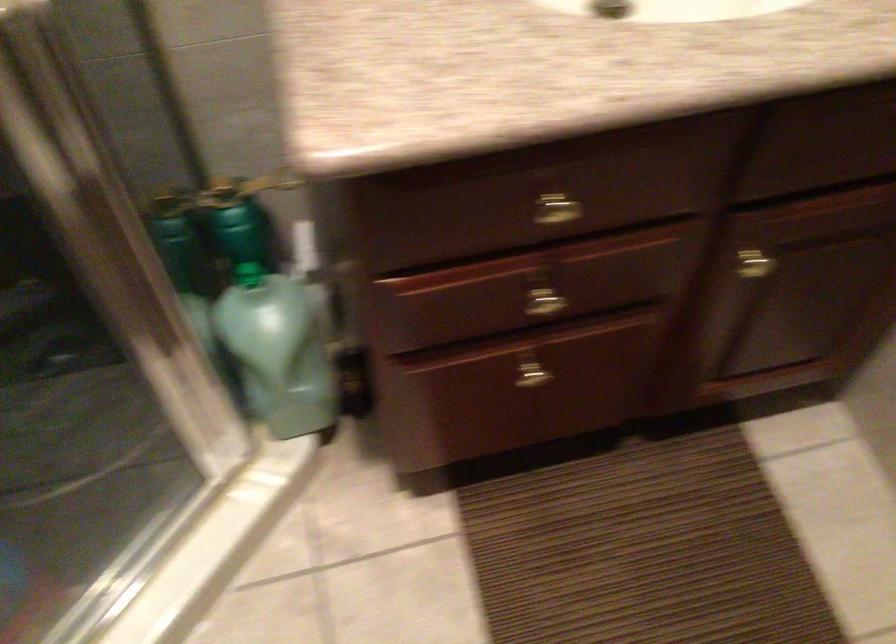
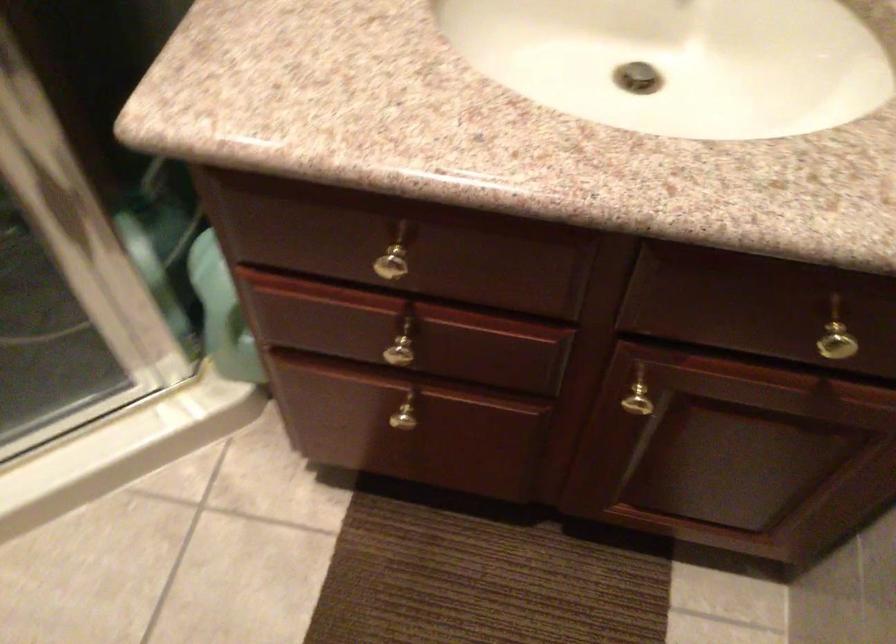
Locate, in the second image, the point that corresponds to point 748,263 in the first image.

(640, 399)